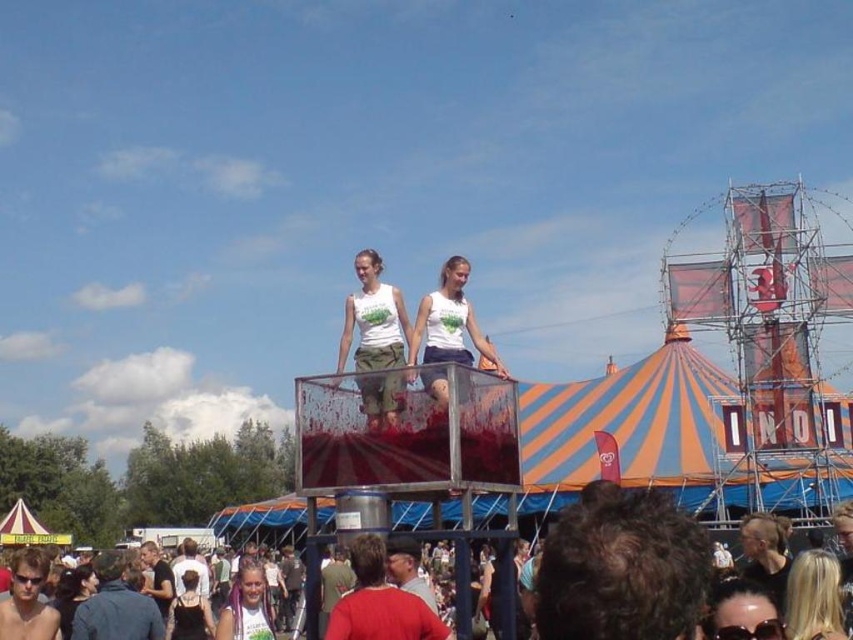
Question: Can you confirm if matte white tank tops at center is wider than blonde hair at lower right?

Choices:
 (A) yes
 (B) no

Answer: (A)

Question: Does matte white tank tops at center appear under blonde hair at lower right?

Choices:
 (A) no
 (B) yes

Answer: (A)

Question: Which point is closer to the camera?

Choices:
 (A) (358, 355)
 (B) (552, 552)
 (C) (201, 620)
 (D) (827, 566)

Answer: (B)

Question: Estimate the real-world distances between objects in this image. Which object is farther from the matte white tank tops at center?

Choices:
 (A) white cotton tank top at center
 (B) black leather dress at lower center
 (C) blonde hair at lower right

Answer: (B)

Question: Considering the real-world distances, which object is farthest from the blonde hair at lower right?

Choices:
 (A) matte white tank tops at center
 (B) white cotton tank top at center
 (C) black leather dress at lower center

Answer: (C)

Question: Can you confirm if matte white tank tops at center is positioned above white cotton tank top at center?

Choices:
 (A) no
 (B) yes

Answer: (A)